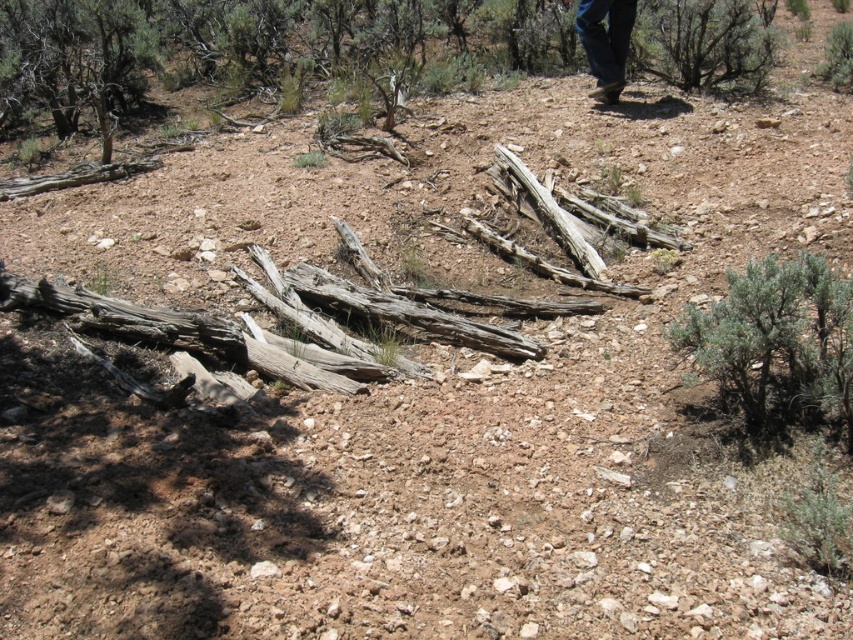
Question: Which point is closer to the camera?

Choices:
 (A) brown suede boots at upper right
 (B) green shrub at center right

Answer: (B)

Question: Considering the real-world distances, which object is farthest from the brown suede boots at upper right?

Choices:
 (A) green shrub at center right
 (B) green leafy bush at upper right

Answer: (A)

Question: Is green shrub at center right to the left of brown suede boots at upper right from the viewer's perspective?

Choices:
 (A) no
 (B) yes

Answer: (B)

Question: From the image, what is the correct spatial relationship of green shrub at center right in relation to green leafy bush at upper right?

Choices:
 (A) left
 (B) right

Answer: (A)

Question: Which point is farther to the camera?

Choices:
 (A) green leafy bush at upper right
 (B) green shrub at center right

Answer: (A)

Question: Is green shrub at center right to the left of brown suede boots at upper right from the viewer's perspective?

Choices:
 (A) yes
 (B) no

Answer: (A)